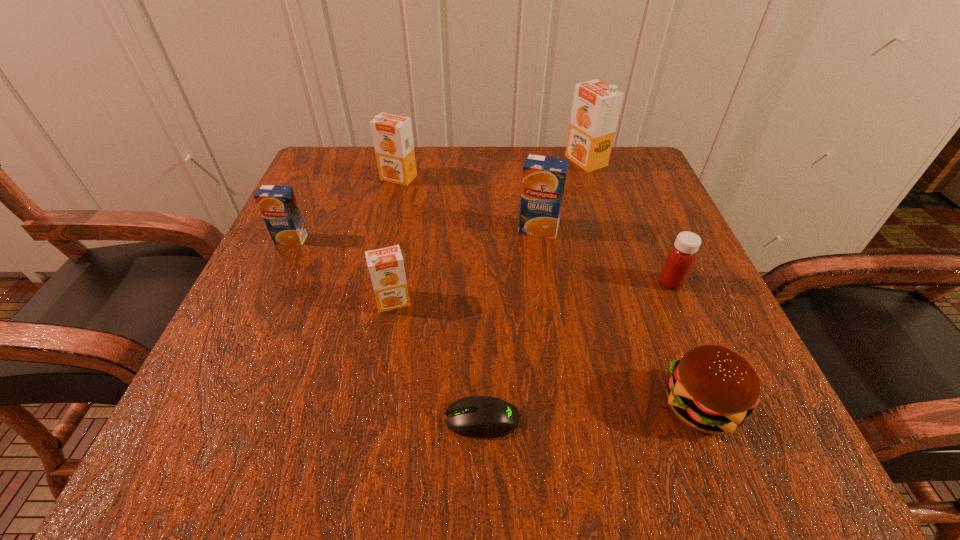
The image size is (960, 540). I want to click on object that is at the near right corner, so click(x=712, y=389).

I want to click on vacant region at the far edge, so click(559, 155).

In the image, there is a desktop. Where is `free space at the near edge`? free space at the near edge is located at coordinates (573, 433).

Locate an element on the screen. vacant space at the left edge is located at coordinates (255, 377).

In the image, there is a desktop. Identify the location of free space at the right edge. (635, 240).

In the image, there is a desktop. Where is `free region at the near left corner`? Image resolution: width=960 pixels, height=540 pixels. free region at the near left corner is located at coordinates (288, 414).

The width and height of the screenshot is (960, 540). Identify the location of vacant space at the far right corner of the desktop. click(x=605, y=172).

This screenshot has height=540, width=960. What are the coordinates of `free space that is in between the leftmost orange juice and the brown hamburger` in the screenshot? It's located at (495, 322).

Find the location of a particular element. The width and height of the screenshot is (960, 540). blank region between the hamburger and the biggest orange orange juice is located at coordinates (643, 283).

Where is `vacant space that's between the brown hamburger and the smaller blue orange_juice`? This screenshot has height=540, width=960. vacant space that's between the brown hamburger and the smaller blue orange_juice is located at coordinates (495, 322).